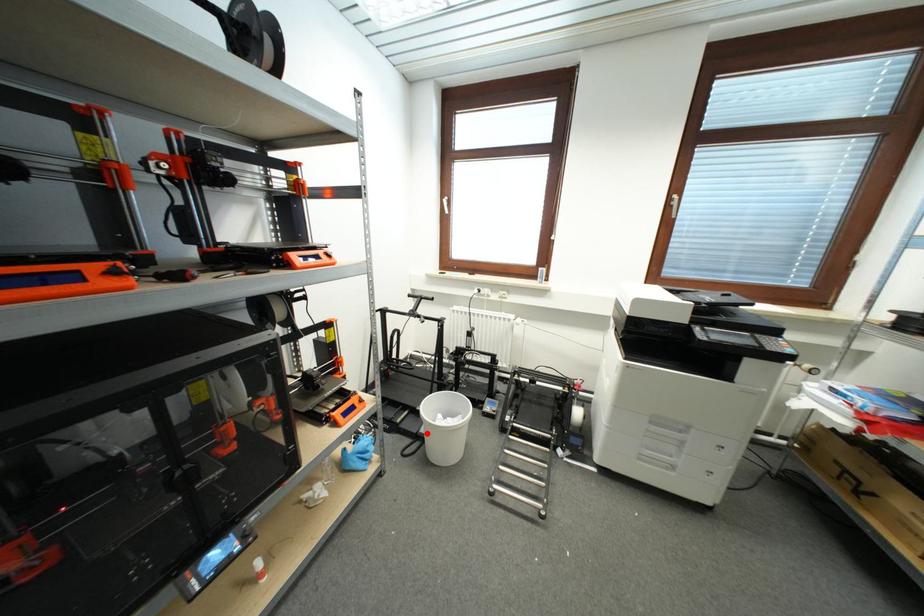
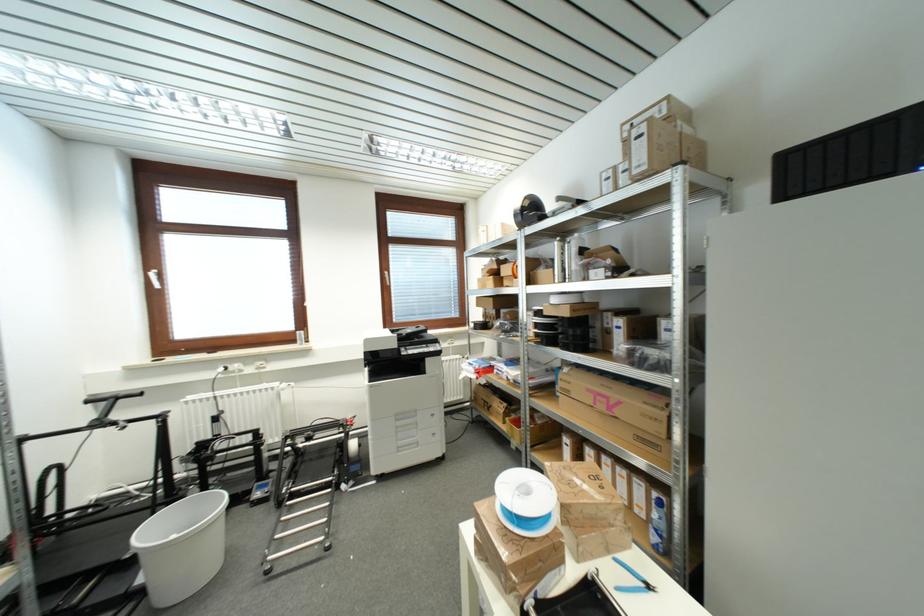
Question: I am providing you with two images of the same scene from different viewpoints. Given a red point in image1, look at the same physical point in image2. Is it:

Choices:
 (A) Closer to the viewpoint
 (B) Farther from the viewpoint

Answer: (A)